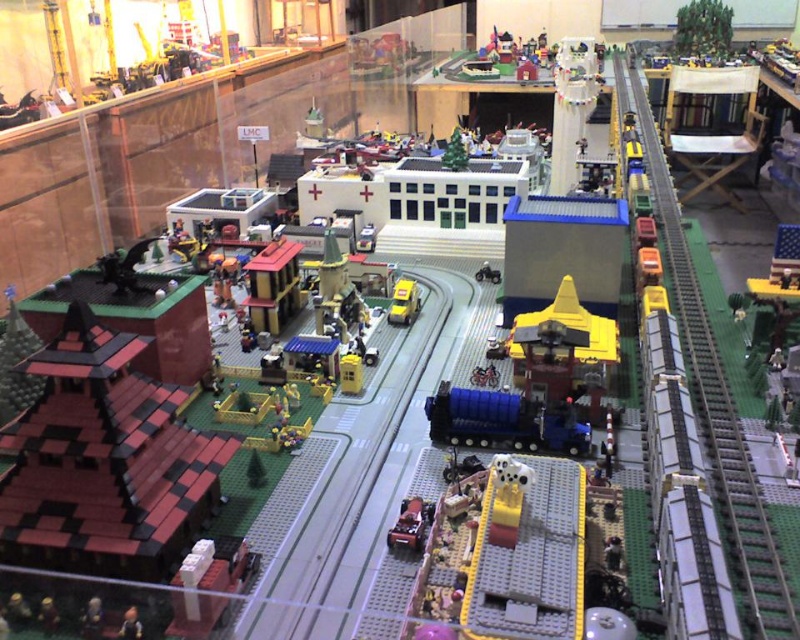
You are a Lego figure standing at the entrance of the red building with a black and white checkered roof. You need to reach the yellow plastic car at center. Can you see the green plastic train track at right from your current position?

Yes, because the green plastic train track at right is in front of the yellow plastic car at center, so the green plastic train track at right is closer to you and would block your view of the yellow plastic car at center.

You are a delivery drone that needs to pass between two objects in the Lego cityscape. You have a width of 0.5 meters. The path between the metallic silver train at center and the yellow plastic car at center is narrow. Can you safely navigate through this path?

The metallic silver train at center has a lesser width compared to the yellow plastic car at center, so the path between them is narrow. Since the drone is 0.5 meters wide, it can safely navigate through the path as the width is sufficient for its size.

You are a Lego figure standing in the Lego cityscape. You see a metallic silver train at center and a yellow plastic car at center. Which object is closer to you?

The metallic silver train at center is closer to you than the yellow plastic car at center.